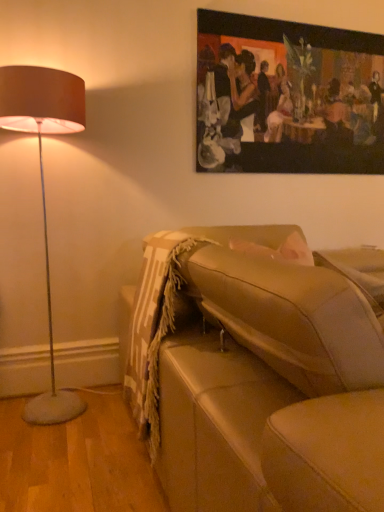
Question: From a real-world perspective, is beige leather couch at lower right located higher than oil painting at upper center?

Choices:
 (A) no
 (B) yes

Answer: (A)

Question: Does beige leather couch at lower right appear on the right side of oil painting at upper center?

Choices:
 (A) no
 (B) yes

Answer: (A)

Question: From the image's perspective, is beige leather couch at lower right above oil painting at upper center?

Choices:
 (A) yes
 (B) no

Answer: (B)

Question: Would you say beige leather couch at lower right contains oil painting at upper center?

Choices:
 (A) yes
 (B) no

Answer: (B)

Question: From a real-world perspective, is beige leather couch at lower right positioned under oil painting at upper center based on gravity?

Choices:
 (A) yes
 (B) no

Answer: (A)

Question: Considering the relative positions of beige leather couch at lower right and oil painting at upper center in the image provided, is beige leather couch at lower right in front of oil painting at upper center?

Choices:
 (A) yes
 (B) no

Answer: (A)

Question: Does oil painting at upper center touch beige leather couch at lower right?

Choices:
 (A) no
 (B) yes

Answer: (A)

Question: Is oil painting at upper center thinner than beige leather couch at lower right?

Choices:
 (A) yes
 (B) no

Answer: (A)

Question: Is oil painting at upper center to the left of beige leather couch at lower right from the viewer's perspective?

Choices:
 (A) yes
 (B) no

Answer: (B)

Question: Does oil painting at upper center have a greater height compared to beige leather couch at lower right?

Choices:
 (A) no
 (B) yes

Answer: (B)

Question: Considering the relative positions of oil painting at upper center and beige leather couch at lower right in the image provided, is oil painting at upper center in front of beige leather couch at lower right?

Choices:
 (A) yes
 (B) no

Answer: (B)

Question: Would you say beige leather couch at lower right is part of oil painting at upper center's contents?

Choices:
 (A) no
 (B) yes

Answer: (A)

Question: Is oil painting at upper center taller or shorter than beige leather couch at lower right?

Choices:
 (A) tall
 (B) short

Answer: (A)